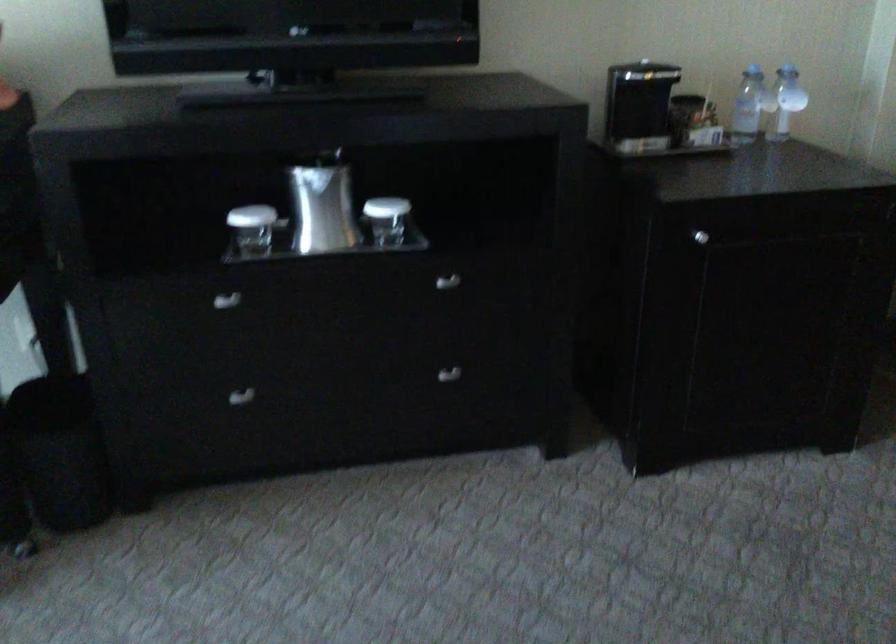
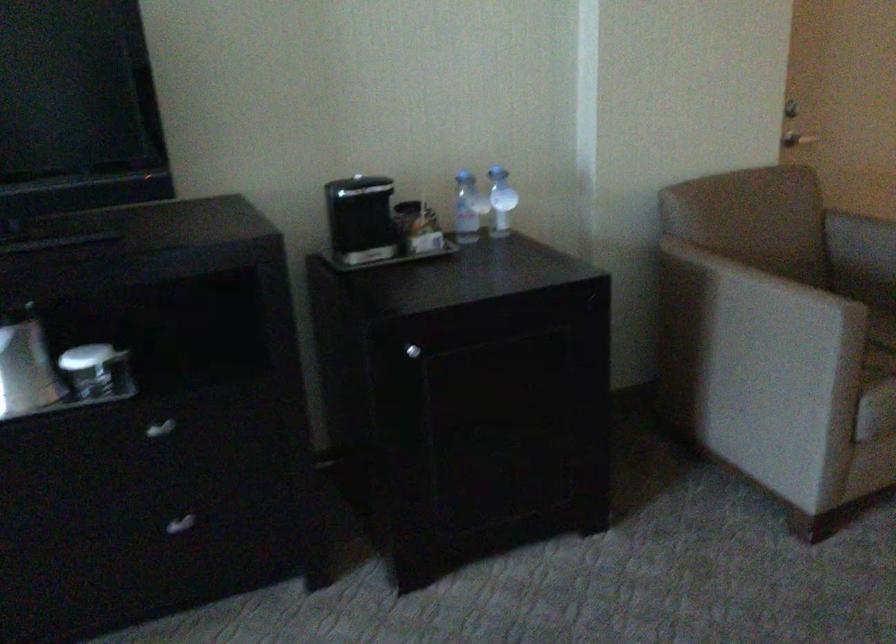
Question: The first image is from the beginning of the video and the second image is from the end. How did the camera likely rotate when shooting the video?

Choices:
 (A) Left
 (B) Right
 (C) Up
 (D) Down

Answer: (B)